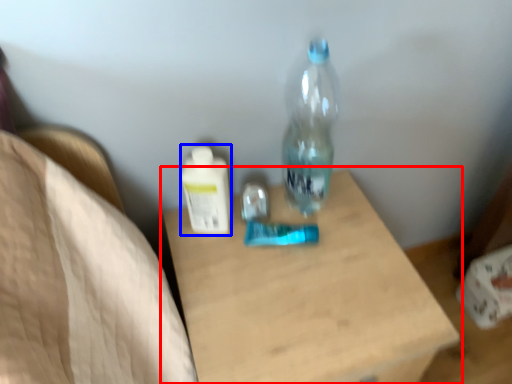
Question: Which of the following is the closest to the observer, table (highlighted by a red box) or bottle (highlighted by a blue box)?

Choices:
 (A) table
 (B) bottle

Answer: (A)